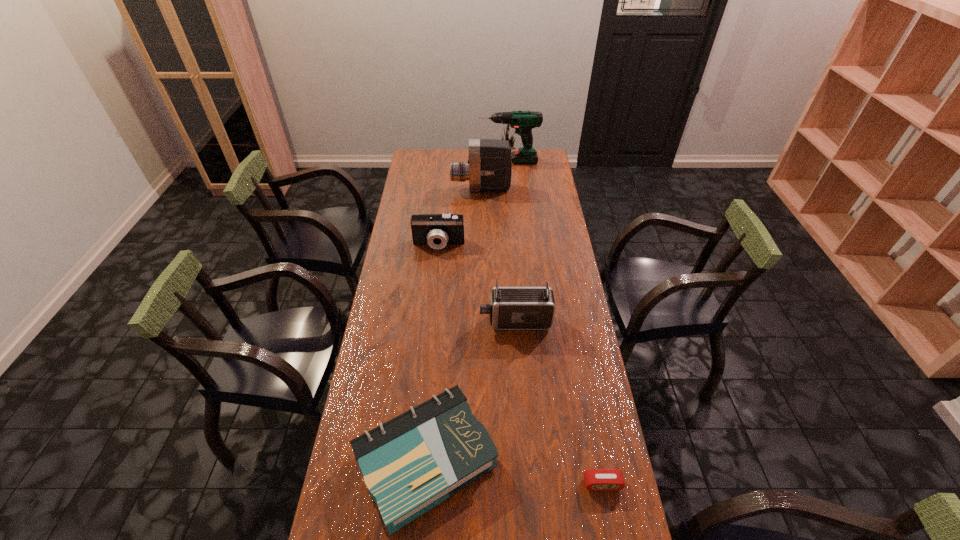
Find the location of `free space that is in between the tallest camcorder and the fifth tallest object`. free space that is in between the tallest camcorder and the fifth tallest object is located at coordinates 453,325.

You are a GUI agent. You are given a task and a screenshot of the screen. Output one action in this format:
    pyautogui.click(x=<x>, y=<y>)
    Task: Click on the empty location between the paperback book and the fourth shortest object
    The width and height of the screenshot is (960, 540).
    Given the screenshot: What is the action you would take?
    pyautogui.click(x=470, y=390)

In order to click on object that stands as the third closest to the tallest camcorder in this screenshot , I will do `click(511, 308)`.

Choose which object is the third nearest neighbor to the fifth tallest object. Please provide its 2D coordinates. Your answer should be formatted as a tuple, i.e. [(x, y)], where the tuple contains the x and y coordinates of a point satisfying the conditions above.

[(437, 230)]

Select which camcorder appears as the second closest to the third tallest object. Please provide its 2D coordinates. Your answer should be formatted as a tuple, i.e. [(x, y)], where the tuple contains the x and y coordinates of a point satisfying the conditions above.

[(489, 168)]

You are a GUI agent. You are given a task and a screenshot of the screen. Output one action in this format:
    pyautogui.click(x=<x>, y=<y>)
    Task: Click on the second closest camcorder relative to the nearest camcorder
    The width and height of the screenshot is (960, 540).
    Given the screenshot: What is the action you would take?
    pyautogui.click(x=489, y=168)

At what (x,y) coordinates should I click in order to perform the action: click on free point that satisfies the following two spatial constraints: 1. on the lens of the shortest camcorder; 2. on the left side of the paperback book. Please return your answer as a coordinate pair (x, y). This screenshot has height=540, width=960. Looking at the image, I should click on (418, 460).